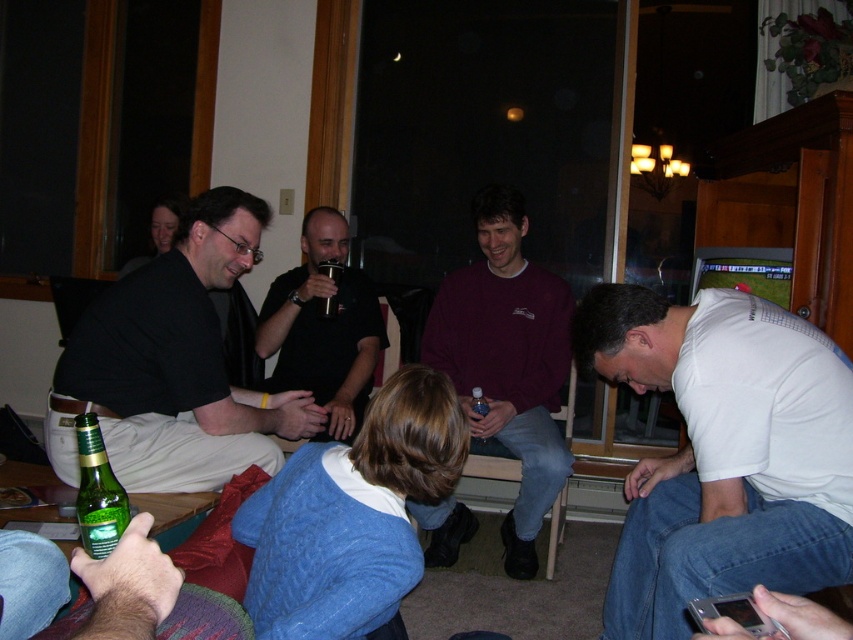
You are a photographer positioned at the entrance of the living room. You want to take a photo of the maroon sweater at center and the metallic silver cup at center. Which object should you focus on first if you want to capture both in a single shot without moving the camera?

The maroon sweater at center is located below the metallic silver cup at center. Since the photographer is at the entrance, focusing on the metallic silver cup at center first would allow the maroon sweater at center to be captured in the lower part of the frame, ensuring both are included without moving the camera.

You are standing in the living room and want to place a small decorative item on the table. You have two options to choose from, one located at point [521,396] and the other at point [335,268]. Which point is closer to you so that the item will be more visible to guests entering the room?

Point [521,396] is closer to the camera than point [335,268], so placing the item there would make it more visible to guests entering the room.

You are standing in the living room and see a point marked at coordinate (724, 452). Which object is this point located on?

The point at coordinate (724, 452) is located on the white matte shirt at lower right.